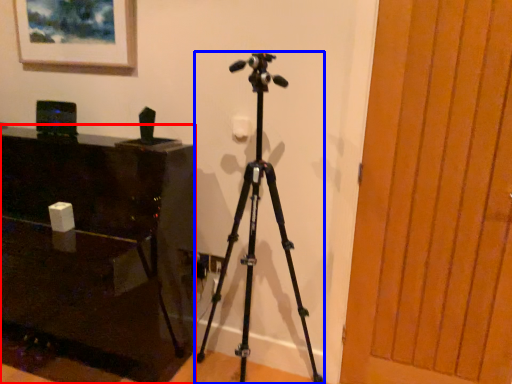
Question: Which of the following is the closest to the observer, furniture (highlighted by a red box) or tripod (highlighted by a blue box)?

Choices:
 (A) furniture
 (B) tripod

Answer: (B)